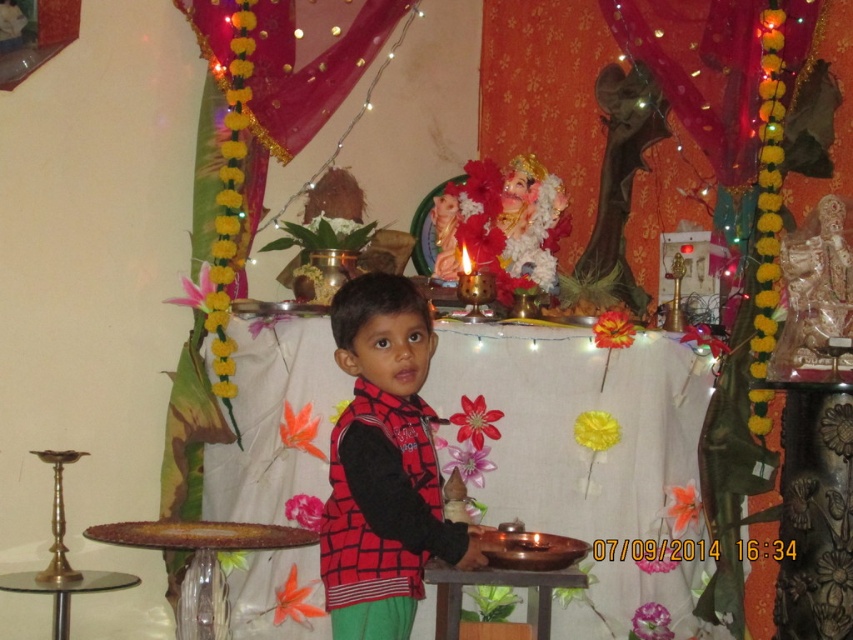
Between shiny brass tray at center and red checkered vest at center, which one is positioned higher?

Positioned higher is red checkered vest at center.

Is point (631, 465) closer to viewer compared to point (436, 536)?

No, it is not.

What are the coordinates of `shiny brass tray at center` in the screenshot? It's located at (582, 456).